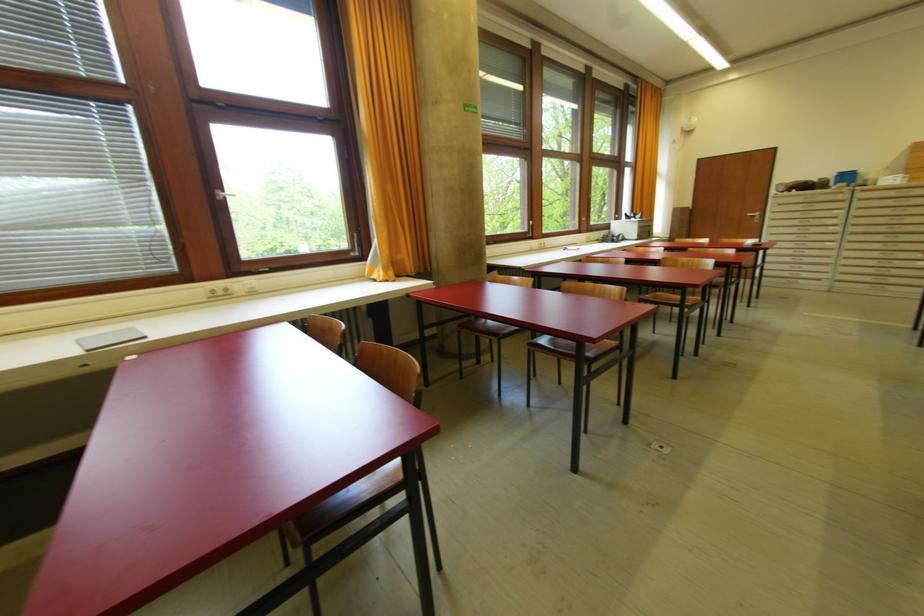
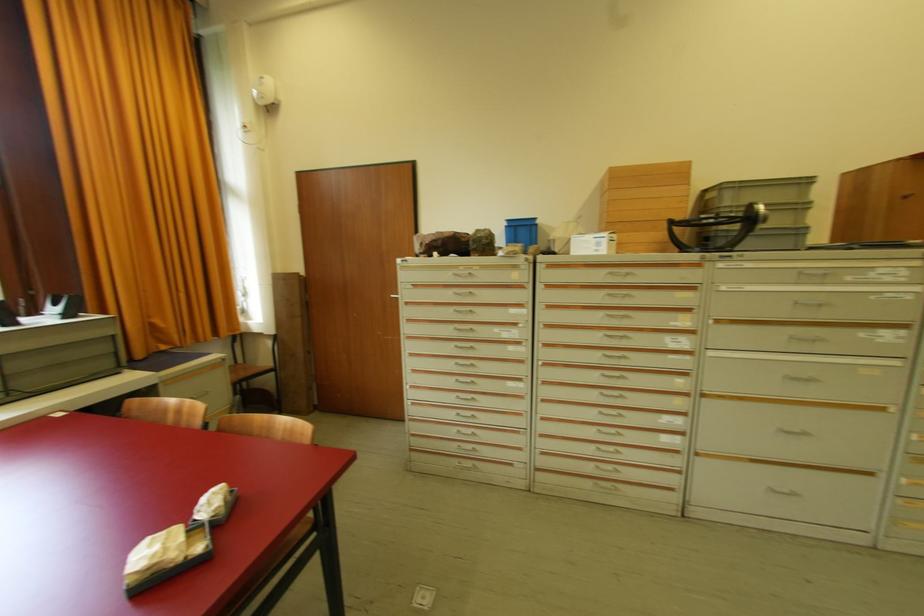
In the second image, find the point that corresponds to point (840, 177) in the first image.

(508, 228)